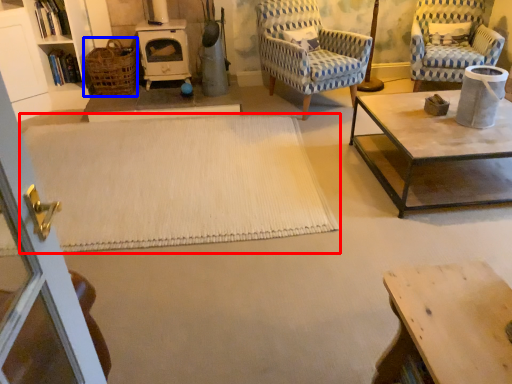
Question: Which of the following is the farthest to the observer, plain (highlighted by a red box) or basket (highlighted by a blue box)?

Choices:
 (A) plain
 (B) basket

Answer: (B)